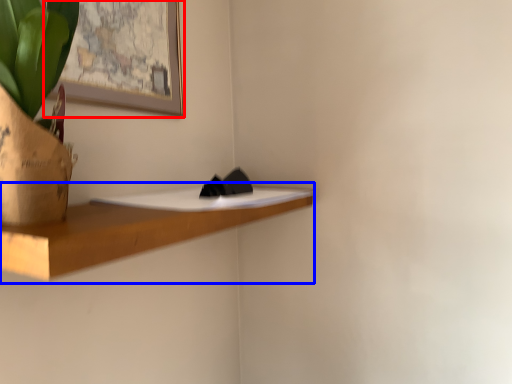
Question: Among these objects, which one is nearest to the camera, picture frame (highlighted by a red box) or shelf (highlighted by a blue box)?

Choices:
 (A) picture frame
 (B) shelf

Answer: (B)